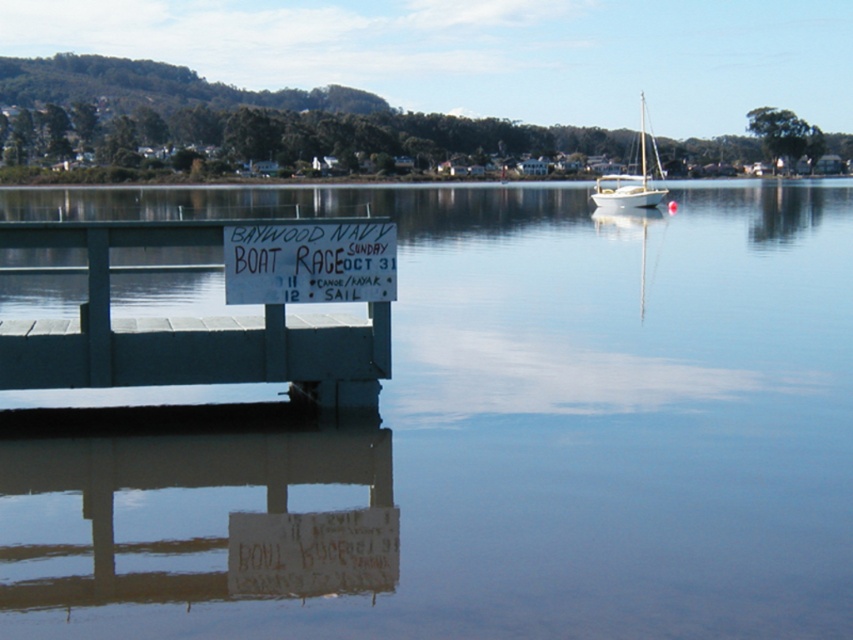
Is point (9, 467) less distant than point (376, 291)?

That is True.

Which is in front, point (16, 484) or point (279, 227)?

Point (16, 484) is in front.

Between point (451, 536) and point (234, 250), which one is positioned in front?

Point (451, 536) is in front.

Find the location of a particular element. The width and height of the screenshot is (853, 640). clear water at center is located at coordinates (474, 436).

Between point (16, 481) and point (648, 141), which one is positioned behind?

The point (648, 141) is behind.

Can you confirm if clear water at center is positioned to the left of white sailboat at upper right?

Correct, you'll find clear water at center to the left of white sailboat at upper right.

Between point (645, 352) and point (590, 195), which one is positioned behind?

Point (590, 195)

Locate an element on the screen. The height and width of the screenshot is (640, 853). clear water at center is located at coordinates (474, 436).

The width and height of the screenshot is (853, 640). Describe the element at coordinates (309, 262) in the screenshot. I see `white paper sign at center` at that location.

Who is shorter, white paper sign at center or white sailboat at upper right?

With less height is white paper sign at center.

Who is more forward, [309,253] or [602,193]?

Point [309,253] is in front.

You are a GUI agent. You are given a task and a screenshot of the screen. Output one action in this format:
    pyautogui.click(x=<x>, y=<y>)
    Task: Click on the white paper sign at center
    
    Given the screenshot: What is the action you would take?
    pyautogui.click(x=309, y=262)